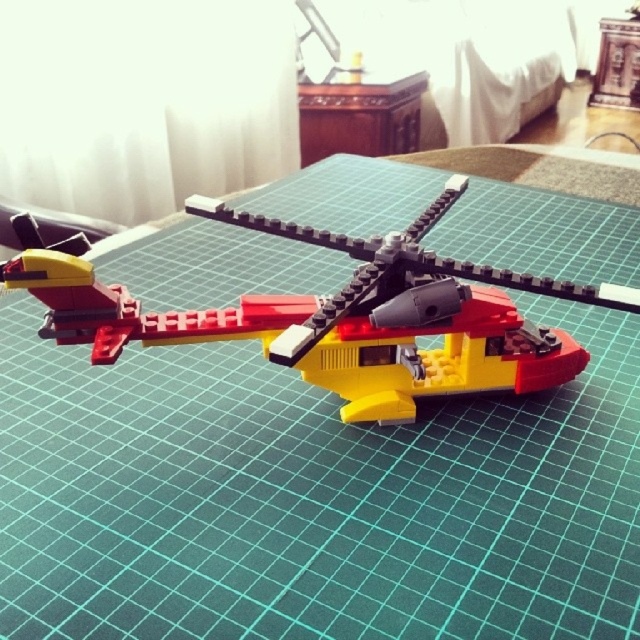
Question: Does yellow plastic helicopter at center appear on the right side of wooden table at center?

Choices:
 (A) yes
 (B) no

Answer: (B)

Question: Is the position of yellow plastic helicopter at center less distant than that of wooden table at center?

Choices:
 (A) no
 (B) yes

Answer: (B)

Question: Which object appears closest to the camera in this image?

Choices:
 (A) wooden table at center
 (B) yellow plastic helicopter at center

Answer: (B)

Question: Which point is closer to the camera?

Choices:
 (A) (410, 314)
 (B) (374, 134)

Answer: (A)

Question: Is yellow plastic helicopter at center further to the viewer compared to wooden table at center?

Choices:
 (A) yes
 (B) no

Answer: (B)